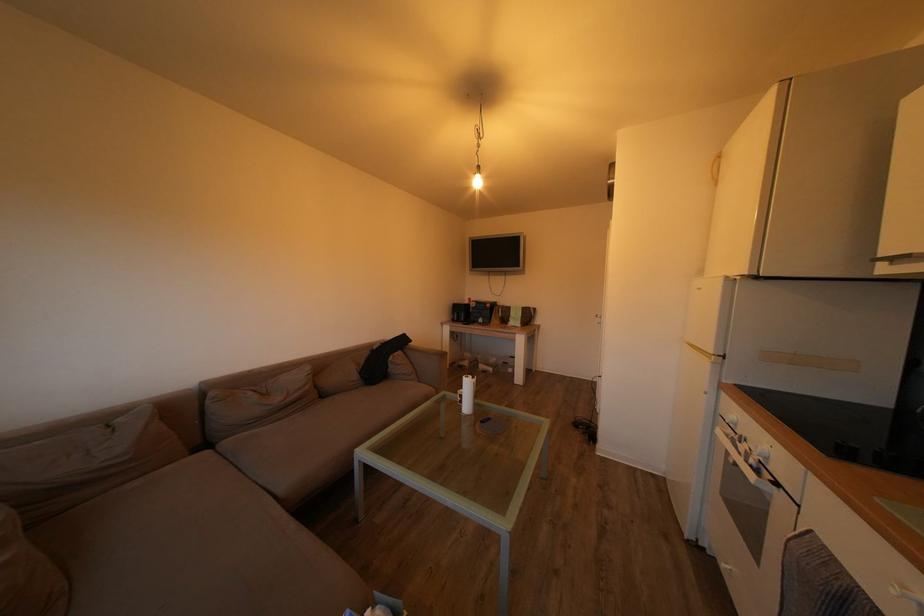
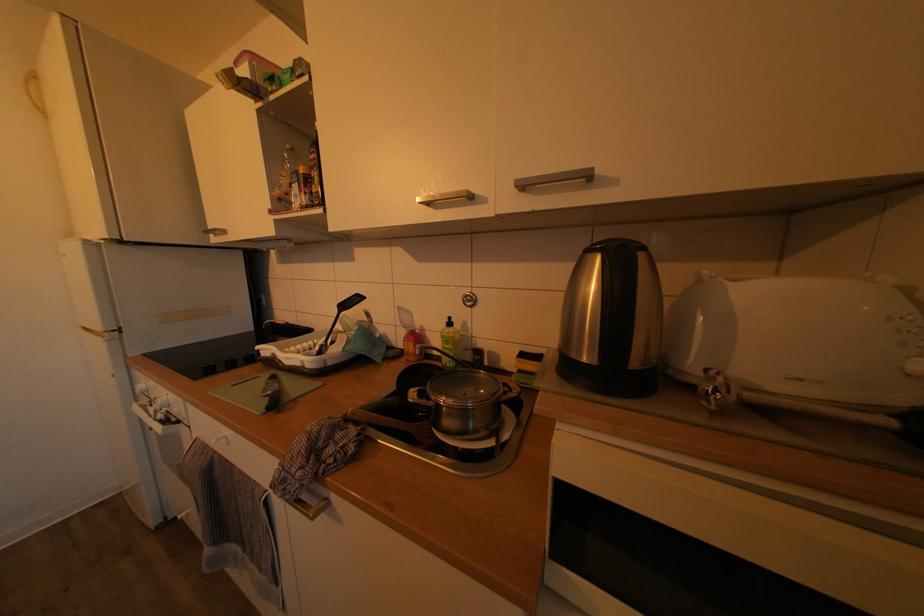
Question: Based on the continuous images, in which direction is the camera rotating? Reply with the corresponding letter.

Choices:
 (A) Left
 (B) Right
 (C) Up
 (D) Down

Answer: (B)